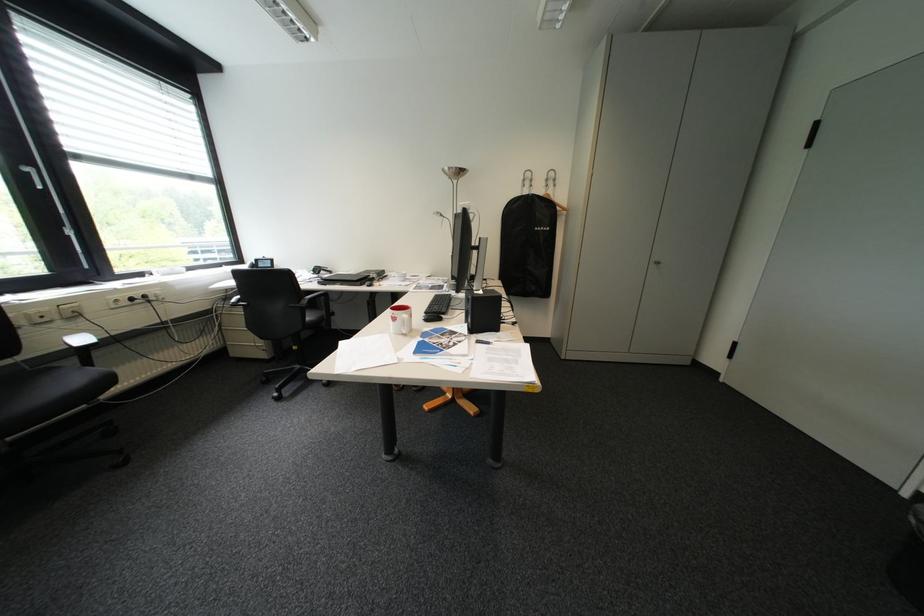
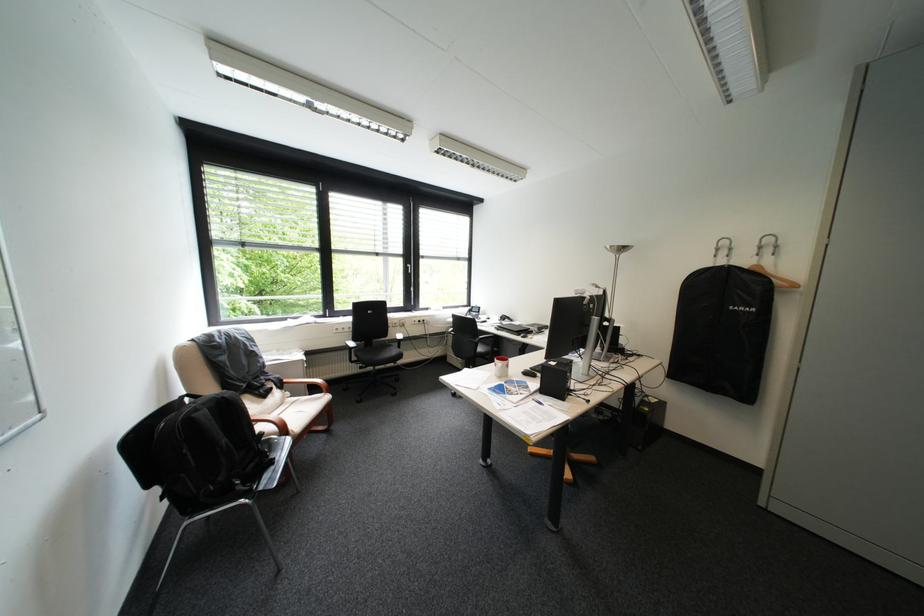
Where in the second image is the point corresponding to pixel 553 229 from the first image?

(755, 309)